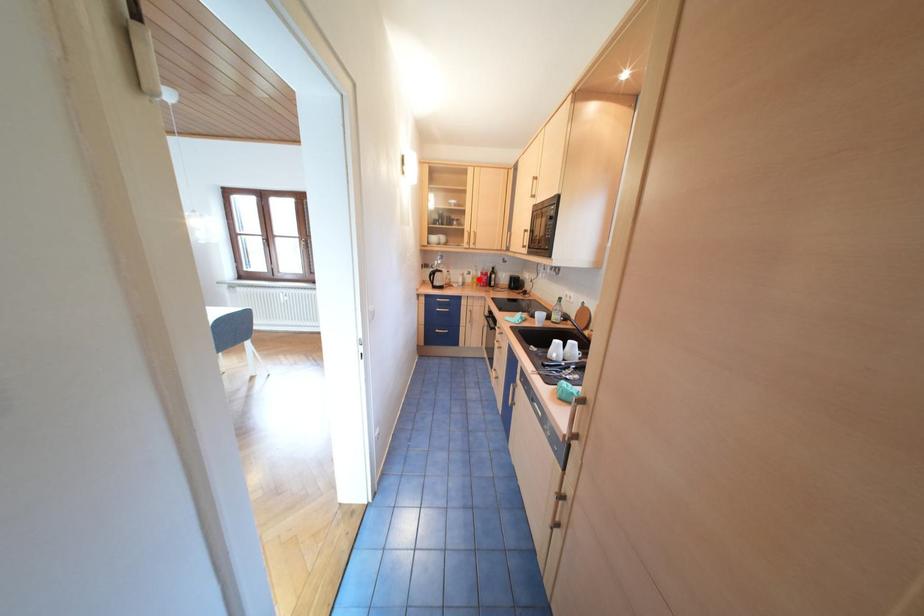
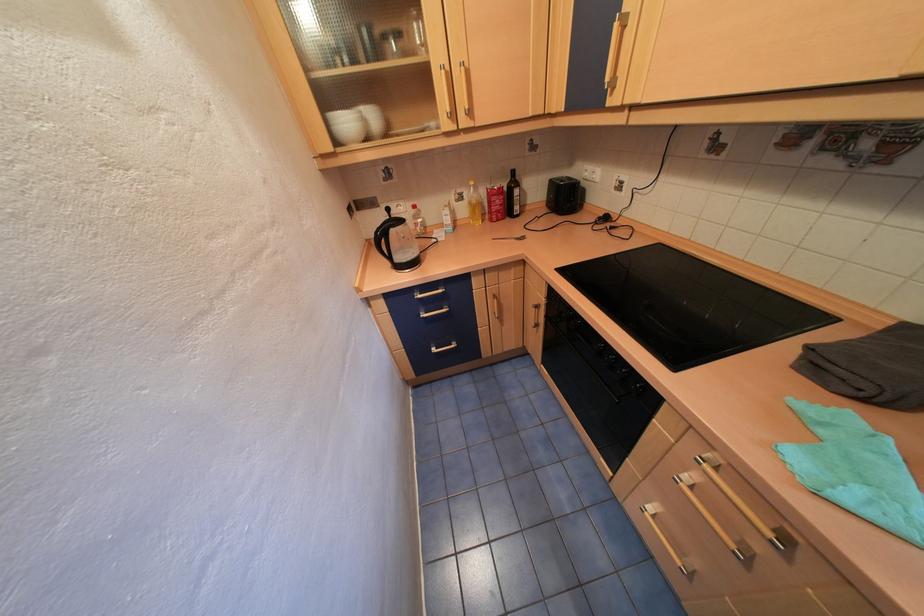
Find the pixel in the second image that matches the highlighted location in the first image.

(472, 211)